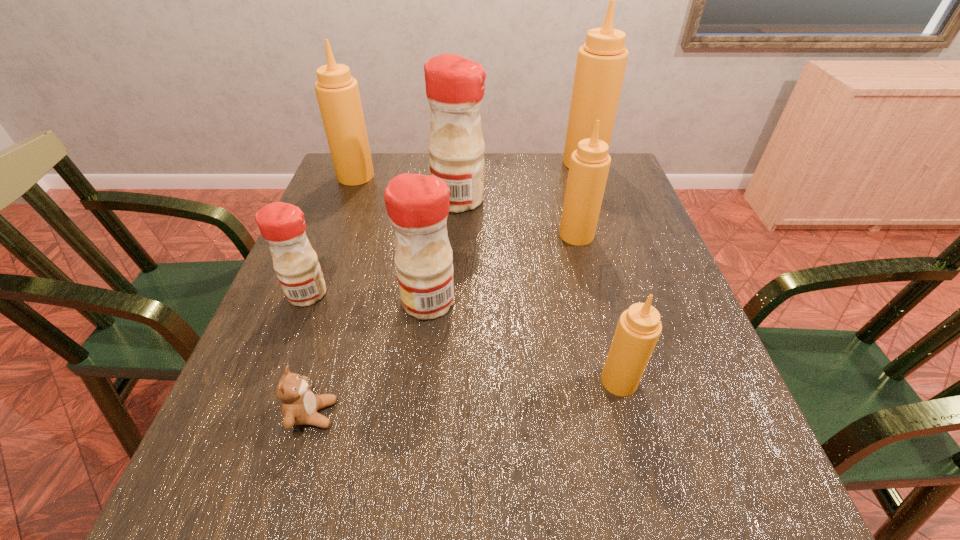
Find the location of a particular element. The height and width of the screenshot is (540, 960). vacant space in between the nearest tan condiment and the biggest tan condiment is located at coordinates (602, 272).

You are a GUI agent. You are given a task and a screenshot of the screen. Output one action in this format:
    pyautogui.click(x=<x>, y=<y>)
    Task: Click on the unoccupied area between the teddy bear and the farthest red condiment
    The height and width of the screenshot is (540, 960).
    Given the screenshot: What is the action you would take?
    pyautogui.click(x=386, y=307)

Where is `empty space between the second nearest tan condiment and the farthest red condiment`? This screenshot has width=960, height=540. empty space between the second nearest tan condiment and the farthest red condiment is located at coordinates coord(517,217).

Identify the location of free spot between the smallest red condiment and the second smallest red condiment. (369, 298).

Find the location of a particular element. The image size is (960, 540). object identified as the fourth closest to the third farthest tan condiment is located at coordinates (639, 327).

Locate which object is the fifth closest to the smallest red condiment. Please provide its 2D coordinates. Your answer should be formatted as a tuple, i.e. [(x, y)], where the tuple contains the x and y coordinates of a point satisfying the conditions above.

[(589, 166)]

Select which condiment appears as the third closest to the second biggest tan condiment. Please provide its 2D coordinates. Your answer should be formatted as a tuple, i.e. [(x, y)], where the tuple contains the x and y coordinates of a point satisfying the conditions above.

[(417, 205)]

The image size is (960, 540). In order to click on the third closest condiment relative to the leftmost red condiment in this screenshot , I will do `click(337, 92)`.

Locate which tan condiment is the third closest to the second biggest red condiment. Please provide its 2D coordinates. Your answer should be formatted as a tuple, i.e. [(x, y)], where the tuple contains the x and y coordinates of a point satisfying the conditions above.

[(337, 92)]

The height and width of the screenshot is (540, 960). What are the coordinates of `the fourth closest tan condiment to the leftmost red condiment` in the screenshot? It's located at (601, 62).